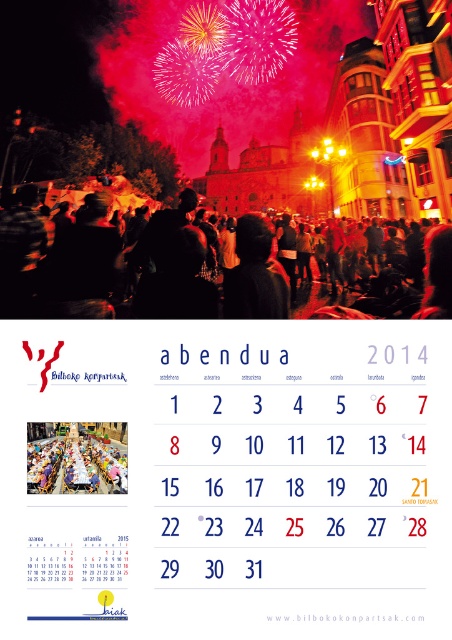
You are an artist trying to sketch the scene. You want to place a white paper calendar at center in your drawing. Where should you position it?

The white paper calendar at center should be positioned at point [230,477].

You are standing in front of the image and want to touch both the white paper calendar at center and the dark hair at center. Which object will your hand reach first?

The white paper calendar at center is closer to the viewer than the dark hair at center, so you will reach the white paper calendar at center first.

You are standing in the lower section of the image which shows a calendar for the year 2014. There is a point marked at coordinates (230, 477). What does this point indicate?

The point at coordinates (230, 477) marks the white paper calendar at center.